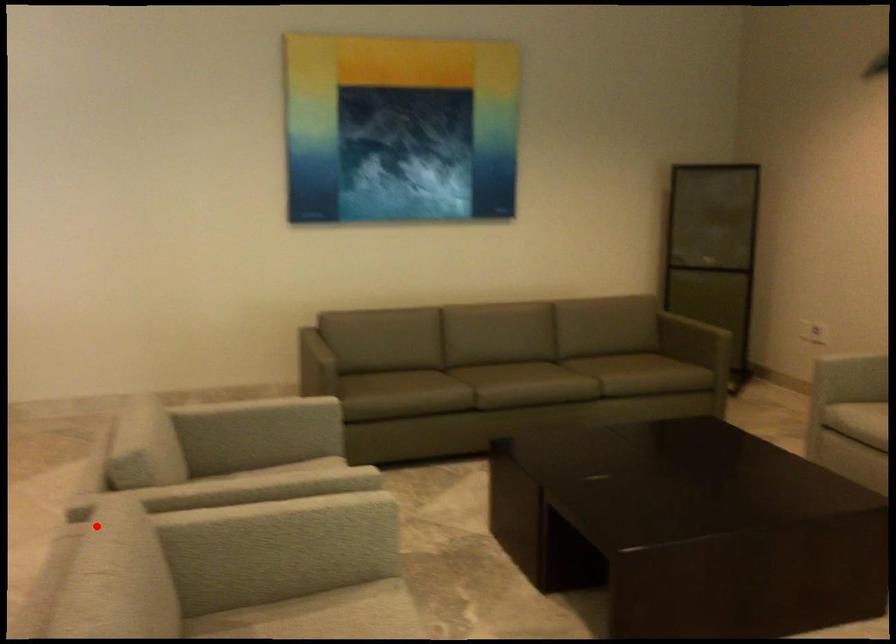
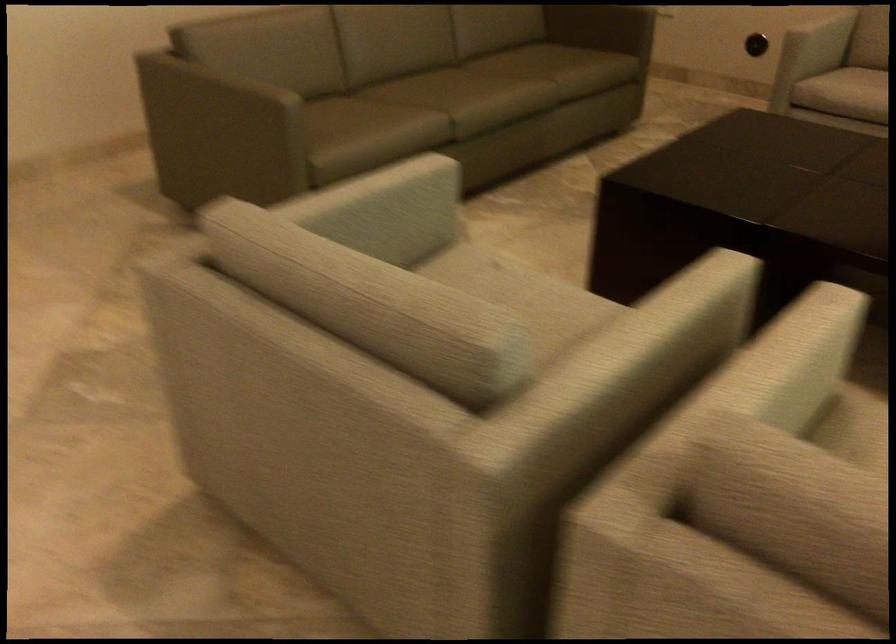
Question: A red point is marked in image1. In image2, is the corresponding 3D point closer to the camera or farther? Reply with the corresponding letter.

Choices:
 (A) The corresponding 3D point is closer.
 (B) The corresponding 3D point is farther.

Answer: (A)